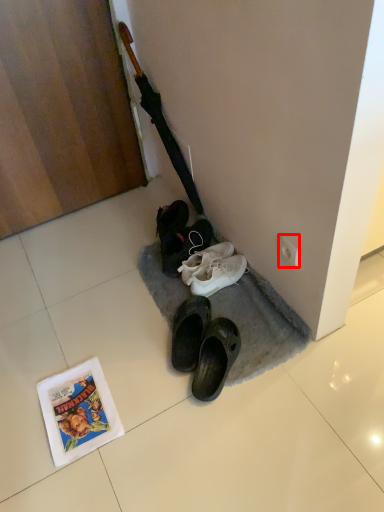
Question: In this image, where is power outlet (annotated by the red box) located relative to comic book?

Choices:
 (A) left
 (B) right

Answer: (B)